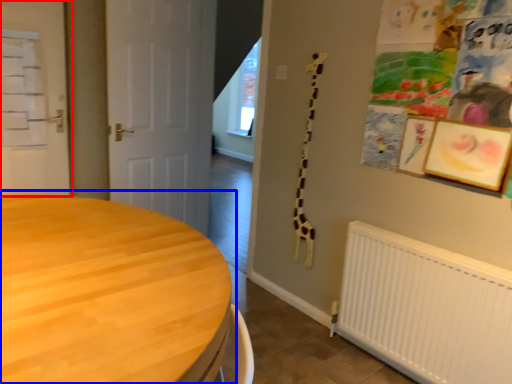
Question: Which object is closer to the camera taking this photo, door (highlighted by a red box) or table (highlighted by a blue box)?

Choices:
 (A) door
 (B) table

Answer: (B)